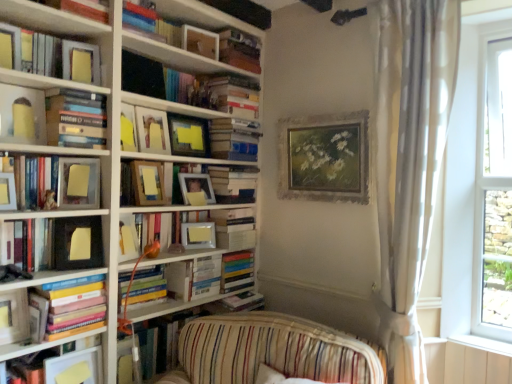
Question: Which direction should I rotate to face gold-framed painting at upper center, which ranks as the 1th picture frame in right-to-left order, — up or down?

Choices:
 (A) up
 (B) down

Answer: (A)

Question: Considering the relative sizes of gold-framed painting at upper center, arranged as the tenth picture frame when viewed from the left, and matte black frame at left, which is the third book from bottom to top, in the image provided, is gold-framed painting at upper center, arranged as the tenth picture frame when viewed from the left, taller than matte black frame at left, which is the third book from bottom to top,?

Choices:
 (A) no
 (B) yes

Answer: (B)

Question: Can you confirm if gold-framed painting at upper center, arranged as the tenth picture frame when viewed from the left, is smaller than matte black frame at left, which is the third book from bottom to top?

Choices:
 (A) yes
 (B) no

Answer: (B)

Question: Can we say gold-framed painting at upper center, which ranks as the 1th picture frame in right-to-left order, lies outside matte black frame at left, which is the third book from bottom to top?

Choices:
 (A) yes
 (B) no

Answer: (A)

Question: Can you confirm if gold-framed painting at upper center, arranged as the tenth picture frame when viewed from the left, is bigger than matte black frame at left, which is the third book from bottom to top?

Choices:
 (A) no
 (B) yes

Answer: (B)

Question: Is gold-framed painting at upper center, which ranks as the 1th picture frame in right-to-left order, wider than matte black frame at left, acting as the thirteenth book starting from the top?

Choices:
 (A) yes
 (B) no

Answer: (B)

Question: Is gold-framed painting at upper center, which ranks as the 1th picture frame in right-to-left order, facing towards matte black frame at left, which is the third book from bottom to top?

Choices:
 (A) yes
 (B) no

Answer: (A)

Question: Does silver metallic picture frame at center, the third picture frame in the right-to-left sequence, appear on the right side of hardcover book at upper center, which is the 14th book in bottom-to-top order?

Choices:
 (A) yes
 (B) no

Answer: (A)

Question: Is silver metallic picture frame at center, marked as the eighth picture frame in a left-to-right arrangement, wider than hardcover book at upper center, which is the 14th book in bottom-to-top order?

Choices:
 (A) no
 (B) yes

Answer: (A)

Question: Can we say silver metallic picture frame at center, marked as the eighth picture frame in a left-to-right arrangement, lies outside hardcover book at upper center, which is the 14th book in bottom-to-top order?

Choices:
 (A) yes
 (B) no

Answer: (A)

Question: Is hardcover book at upper center, which is the 2th book from top to bottom, at the back of silver metallic picture frame at center, the third picture frame in the right-to-left sequence?

Choices:
 (A) no
 (B) yes

Answer: (A)

Question: From a real-world perspective, is silver metallic picture frame at center, the third picture frame in the right-to-left sequence, physically above hardcover book at upper center, which is the 2th book from top to bottom?

Choices:
 (A) yes
 (B) no

Answer: (B)

Question: Is silver metallic picture frame at center, the third picture frame in the right-to-left sequence, far from hardcover book at upper center, which is the 14th book in bottom-to-top order?

Choices:
 (A) yes
 (B) no

Answer: (A)

Question: Is the depth of matte wooden picture frame at upper center, the fifth picture frame viewed from the left, greater than that of gold-framed painting at upper center, which ranks as the 1th picture frame in right-to-left order?

Choices:
 (A) no
 (B) yes

Answer: (B)